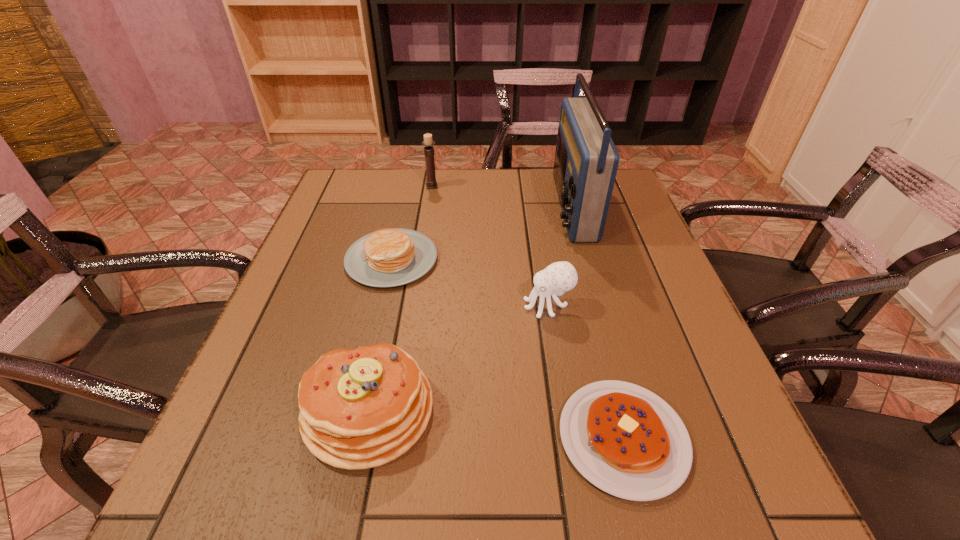
The image size is (960, 540). Find the location of `radio receiver`. radio receiver is located at coordinates (586, 160).

I want to click on candle holder, so click(431, 183).

You are a GUI agent. You are given a task and a screenshot of the screen. Output one action in this format:
    pyautogui.click(x=<x>, y=<y>)
    Task: Click on the octopus
    The width and height of the screenshot is (960, 540).
    Given the screenshot: What is the action you would take?
    pyautogui.click(x=559, y=277)

You are a GUI agent. You are given a task and a screenshot of the screen. Output one action in this format:
    pyautogui.click(x=<x>, y=<y>)
    Task: Click on the tallest pancake
    
    Given the screenshot: What is the action you would take?
    pyautogui.click(x=362, y=408)

Locate an element on the screen. the farthest pancake is located at coordinates (389, 257).

Identify the location of the fifth tallest object. (389, 257).

At what (x,y) coordinates should I click in order to perform the action: click on the rightmost pancake. Please return your answer as a coordinate pair (x, y). This screenshot has height=540, width=960. Looking at the image, I should click on (624, 439).

Find the location of `the shortest pancake`. the shortest pancake is located at coordinates (624, 439).

Image resolution: width=960 pixels, height=540 pixels. Identify the location of vacant point located on the front panel of the radio receiver. (481, 207).

Where is `free space located 0.240m on the front panel of the radio receiver`? free space located 0.240m on the front panel of the radio receiver is located at coordinates (467, 207).